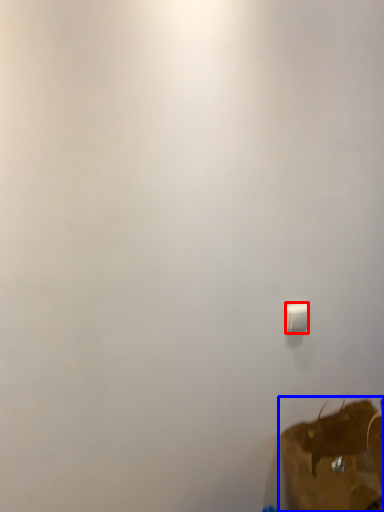
Question: Which point is further to the camera, light switch (highlighted by a red box) or luggage and bags (highlighted by a blue box)?

Choices:
 (A) light switch
 (B) luggage and bags

Answer: (A)